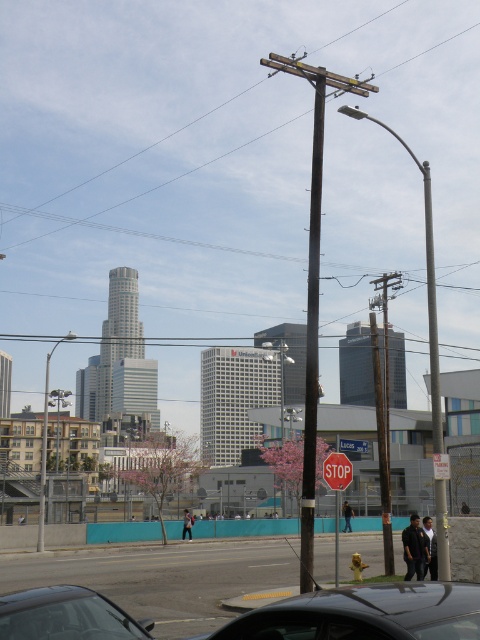
Question: Is black wood pole at center behind wooden pole at center?

Choices:
 (A) yes
 (B) no

Answer: (B)

Question: Which of the following is the closest to the observer?

Choices:
 (A) (90, 628)
 (B) (165, 138)
 (C) (85, 337)

Answer: (A)

Question: Is brown wooden telegraph pole at center positioned at the back of brown wooden utility pole at center-right?

Choices:
 (A) no
 (B) yes

Answer: (A)

Question: Can you confirm if brown wooden utility pole at center-right is bigger than red matte stop sign at center?

Choices:
 (A) no
 (B) yes

Answer: (B)

Question: Which of the following is the farthest from the observer?

Choices:
 (A) (343, 84)
 (B) (335, 454)

Answer: (A)

Question: Which point is closer to the camera taking this photo?

Choices:
 (A) (120, 202)
 (B) (19, 611)
 (C) (361, 449)
 (D) (312, 172)

Answer: (B)